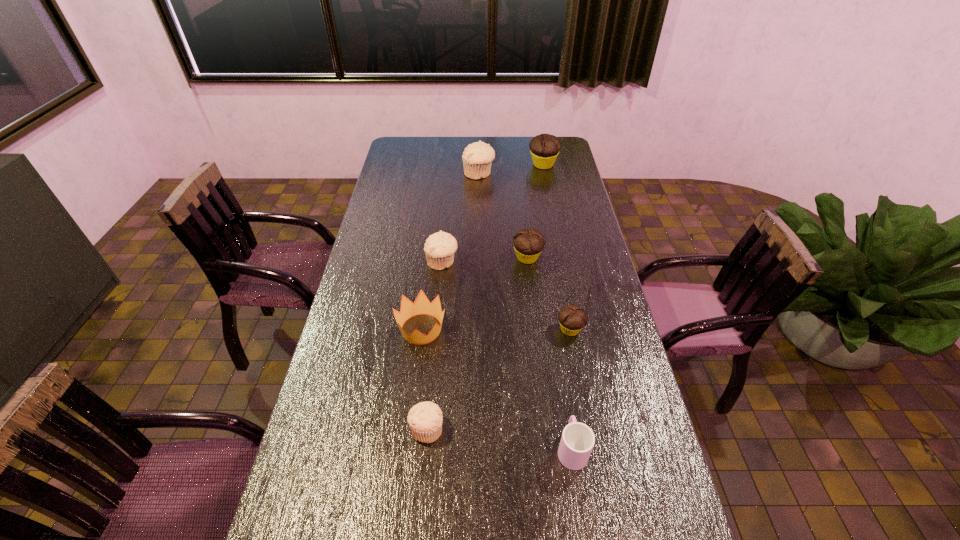
Identify the location of unoccupied area between the nearest chocolate muffin and the second farthest beige muffin. The width and height of the screenshot is (960, 540). (506, 296).

Find the location of `free spot between the farthest beige muffin and the nearest beige muffin`. free spot between the farthest beige muffin and the nearest beige muffin is located at coordinates (453, 301).

Locate an element on the screen. The height and width of the screenshot is (540, 960). object identified as the fifth closest to the cup is located at coordinates (440, 247).

Identify which object is located as the fifth nearest to the farthest chocolate muffin. Please provide its 2D coordinates. Your answer should be formatted as a tuple, i.e. [(x, y)], where the tuple contains the x and y coordinates of a point satisfying the conditions above.

[(421, 305)]

At what (x,y) coordinates should I click in order to perform the action: click on the second closest muffin to the nearest beige muffin. Please return your answer as a coordinate pair (x, y). The image size is (960, 540). Looking at the image, I should click on (440, 247).

Select which muffin is the second closest to the farthest beige muffin. Please provide its 2D coordinates. Your answer should be formatted as a tuple, i.e. [(x, y)], where the tuple contains the x and y coordinates of a point satisfying the conditions above.

[(528, 243)]

Identify which beige muffin is located as the nearest to the smallest beige muffin. Please provide its 2D coordinates. Your answer should be formatted as a tuple, i.e. [(x, y)], where the tuple contains the x and y coordinates of a point satisfying the conditions above.

[(440, 247)]

Identify which beige muffin is located as the third nearest to the nearest chocolate muffin. Please provide its 2D coordinates. Your answer should be formatted as a tuple, i.e. [(x, y)], where the tuple contains the x and y coordinates of a point satisfying the conditions above.

[(477, 157)]

Where is `chocolate muffin that is the second closest to the farthest beige muffin`? The height and width of the screenshot is (540, 960). chocolate muffin that is the second closest to the farthest beige muffin is located at coordinates (528, 243).

Identify which chocolate muffin is located as the third nearest to the smallest beige muffin. Please provide its 2D coordinates. Your answer should be formatted as a tuple, i.e. [(x, y)], where the tuple contains the x and y coordinates of a point satisfying the conditions above.

[(544, 148)]